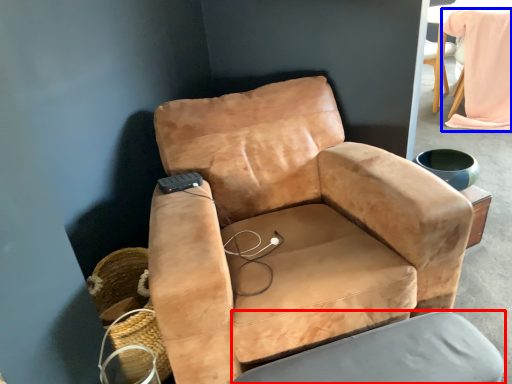
Question: Which point is further to the camera, swivel chair (highlighted by a red box) or bean bag chair (highlighted by a blue box)?

Choices:
 (A) swivel chair
 (B) bean bag chair

Answer: (B)